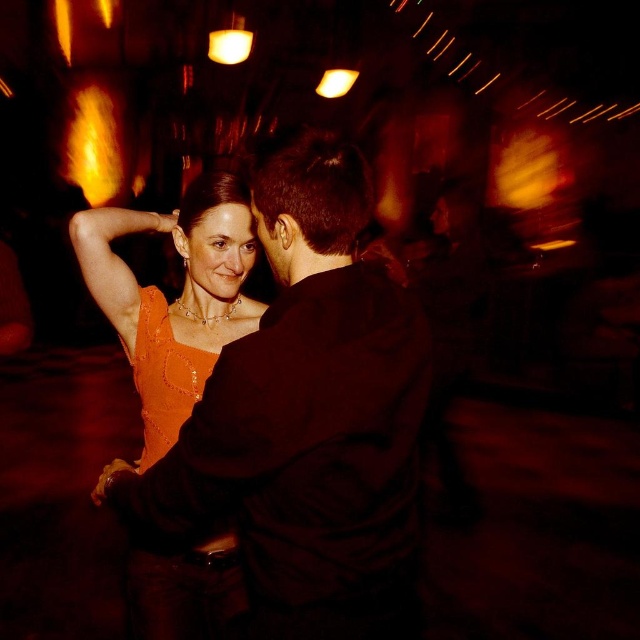
Question: Which object is closer to the camera taking this photo?

Choices:
 (A) orange sequined dress at center
 (B) matte black shirt at center

Answer: (B)

Question: Does orange sequined dress at center appear under shiny orange fabric dress at center?

Choices:
 (A) yes
 (B) no

Answer: (B)

Question: Is orange sequined dress at center thinner than shiny orange fabric dress at center?

Choices:
 (A) yes
 (B) no

Answer: (B)

Question: Considering the real-world distances, which object is closest to the matte black shirt at center?

Choices:
 (A) orange sequined dress at center
 (B) shiny orange fabric dress at center

Answer: (B)

Question: Does matte black shirt at center appear over orange sequined dress at center?

Choices:
 (A) yes
 (B) no

Answer: (B)

Question: Which point is closer to the camera?

Choices:
 (A) shiny orange fabric dress at center
 (B) matte black shirt at center

Answer: (B)